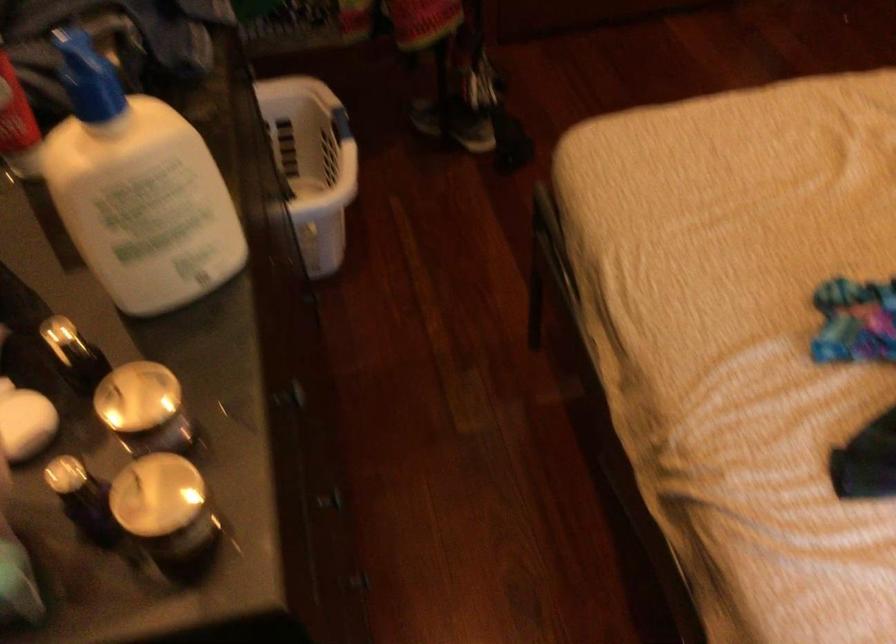
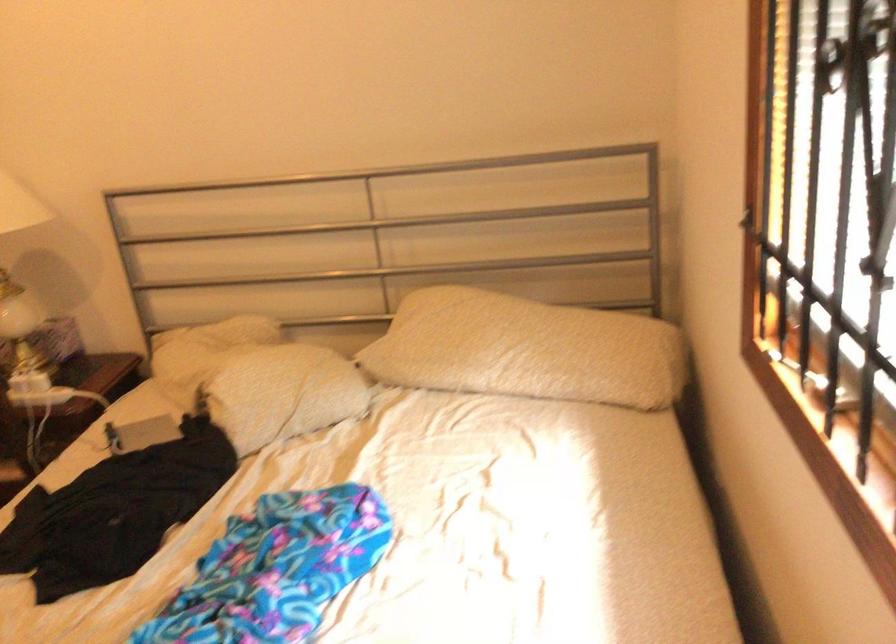
Question: The first image is from the beginning of the video and the second image is from the end. How did the camera likely rotate when shooting the video?

Choices:
 (A) Left
 (B) Right
 (C) Up
 (D) Down

Answer: (B)